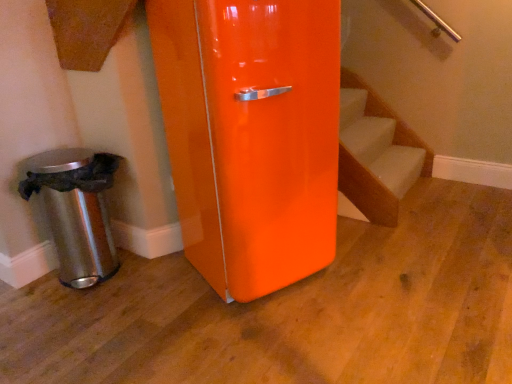
Describe the element at coordinates (76, 210) in the screenshot. I see `polished metallic trash can at lower left` at that location.

Find the location of a particular element. This screenshot has height=384, width=512. polished metallic trash can at lower left is located at coordinates (76, 210).

This screenshot has height=384, width=512. I want to click on polished metallic trash can at lower left, so click(x=76, y=210).